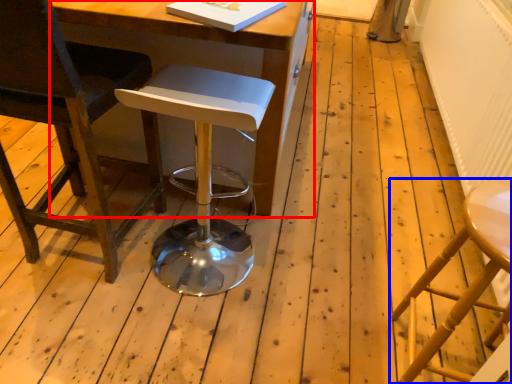
Question: Among these objects, which one is nearest to the camera, table (highlighted by a red box) or stool (highlighted by a blue box)?

Choices:
 (A) table
 (B) stool

Answer: (B)